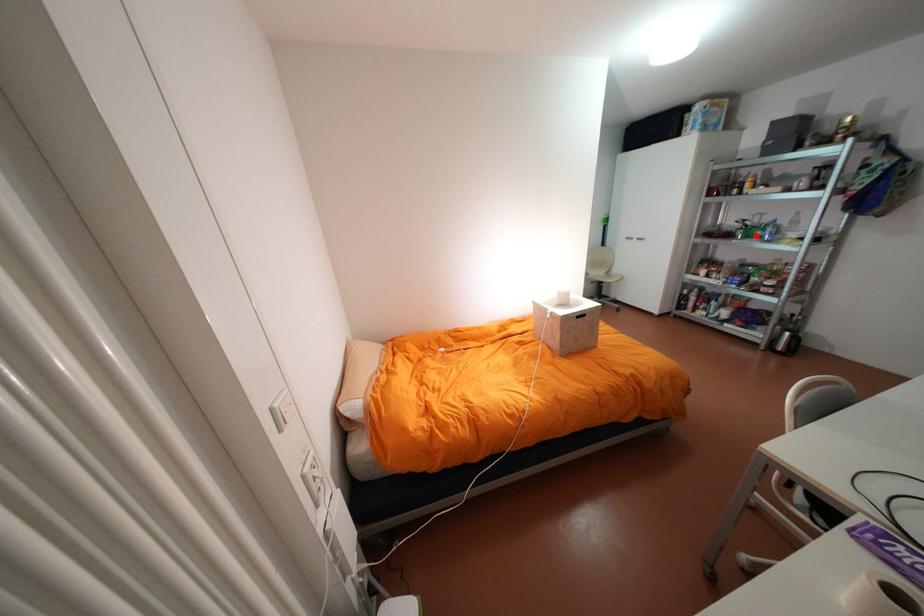
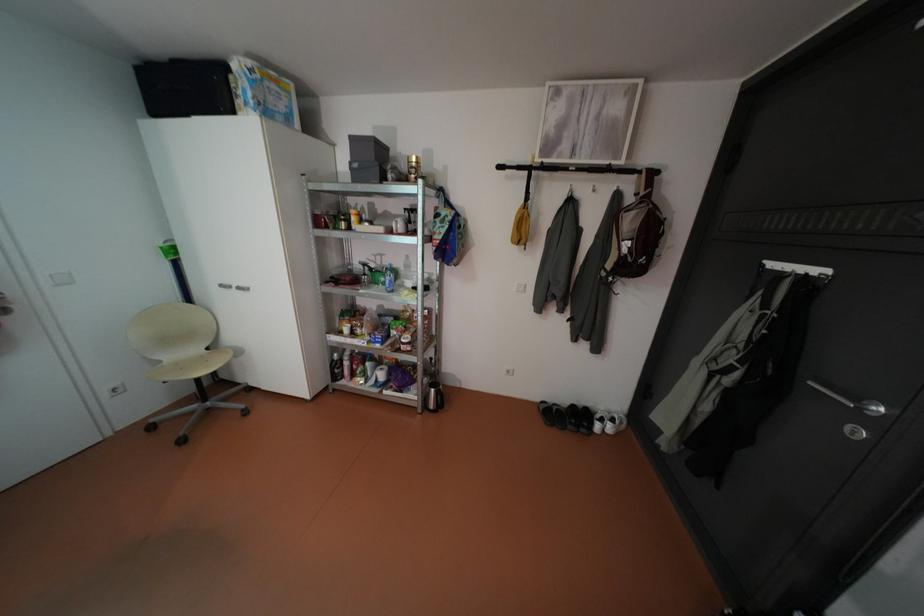
The point at the highlighted location is marked in the first image. Where is the corresponding point in the second image?

(383, 282)